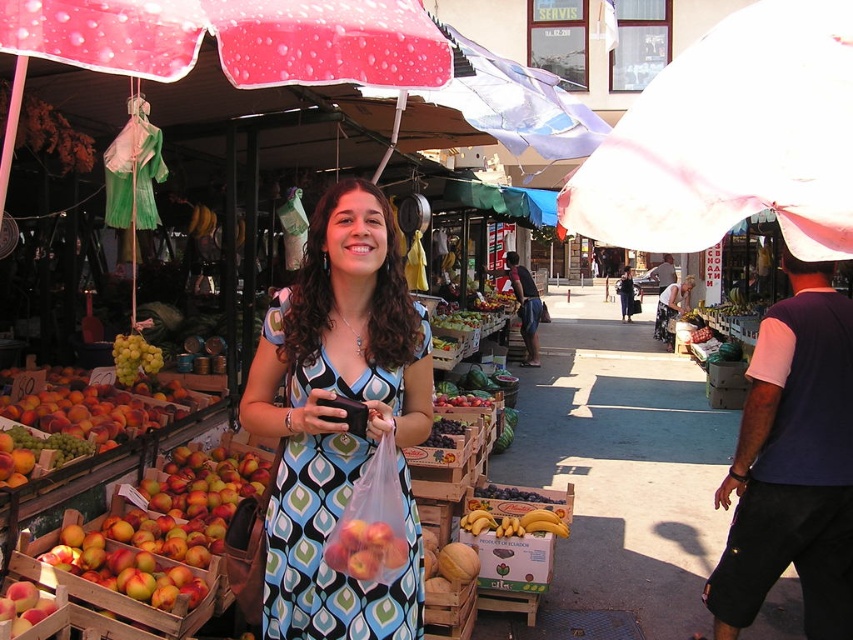
Question: Among these points, which one is nearest to the camera?

Choices:
 (A) (149, 360)
 (B) (753, 136)
 (C) (344, 310)
 (D) (392, 566)

Answer: (B)

Question: Which of the following is the closest to the observer?

Choices:
 (A) pink fabric umbrella at upper right
 (B) shiny red apples at lower left
 (C) green matte grapes at left

Answer: (B)

Question: Does pink fabric umbrella at upper right come in front of green matte grapes at left?

Choices:
 (A) yes
 (B) no

Answer: (A)

Question: Which is farther from the green matte grapes at left?

Choices:
 (A) pink fabric umbrella at upper center
 (B) pink fabric umbrella at upper right

Answer: (B)

Question: Considering the relative positions of matte blue dress at center and shiny red apples at lower left in the image provided, where is matte blue dress at center located with respect to shiny red apples at lower left?

Choices:
 (A) above
 (B) below

Answer: (A)

Question: Considering the relative positions of pink fabric umbrella at upper right and green matte grapes at left in the image provided, where is pink fabric umbrella at upper right located with respect to green matte grapes at left?

Choices:
 (A) above
 (B) below

Answer: (B)